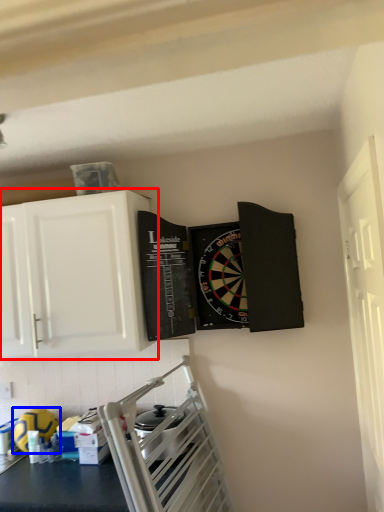
Question: Which of the following is the farthest to the observer, cabinetry (highlighted by a red box) or appliance (highlighted by a blue box)?

Choices:
 (A) cabinetry
 (B) appliance

Answer: (B)